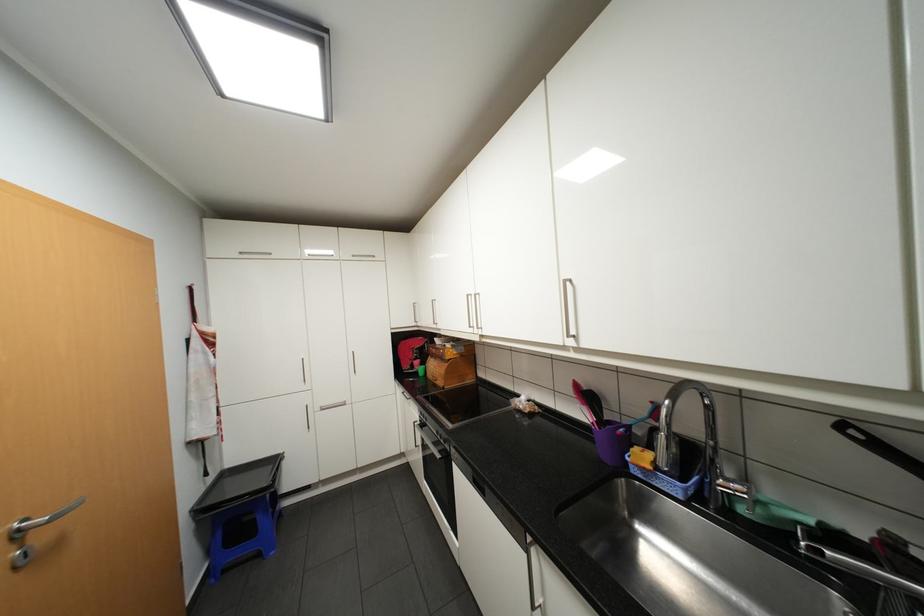
Find the location of a particular element. silver door handle is located at coordinates (34, 523).